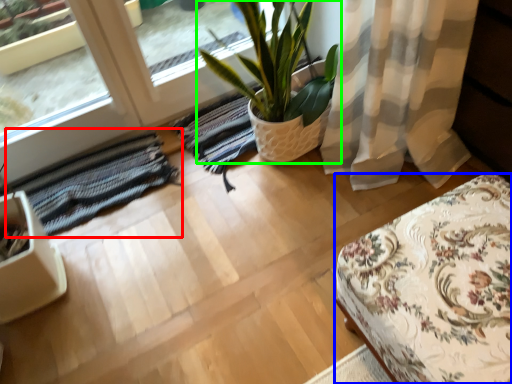
Question: Which is nearer to the mat (highlighted by a red box)? furniture (highlighted by a blue box) or houseplant (highlighted by a green box).

Choices:
 (A) furniture
 (B) houseplant

Answer: (B)